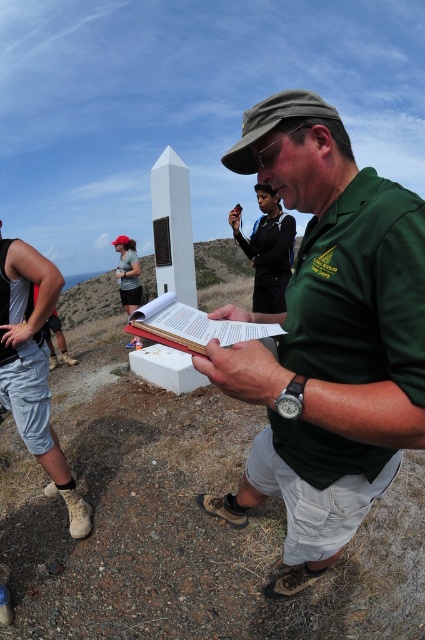
Is black fabric shirt at center thinner than white paper book at center?

No, black fabric shirt at center is not thinner than white paper book at center.

Which is more to the right, black fabric shirt at center or white paper book at center?

Positioned to the right is black fabric shirt at center.

Between point (252, 250) and point (204, 316), which one is positioned in front?

Point (204, 316) is in front.

Find the location of a particular element. black fabric shirt at center is located at coordinates pos(268,250).

Which is below, brushed metal shorts at lower left or black fabric shirt at center?

brushed metal shorts at lower left

Can you confirm if brushed metal shorts at lower left is positioned above black fabric shirt at center?

No.

Does point (34, 282) come closer to viewer compared to point (266, 208)?

Yes, it is.

Identify the location of brushed metal shorts at lower left. (x=34, y=365).

This screenshot has height=640, width=425. What do you see at coordinates (34, 365) in the screenshot?
I see `brushed metal shorts at lower left` at bounding box center [34, 365].

Looking at this image, between brushed metal shorts at lower left and white paper book at center, which one appears on the left side from the viewer's perspective?

Positioned to the left is brushed metal shorts at lower left.

Who is more distant from viewer, (17, 291) or (172, 305)?

Point (17, 291)

At what (x,y) coordinates should I click in order to perform the action: click on brushed metal shorts at lower left. Please return your answer as a coordinate pair (x, y). This screenshot has width=425, height=640. Looking at the image, I should click on (34, 365).